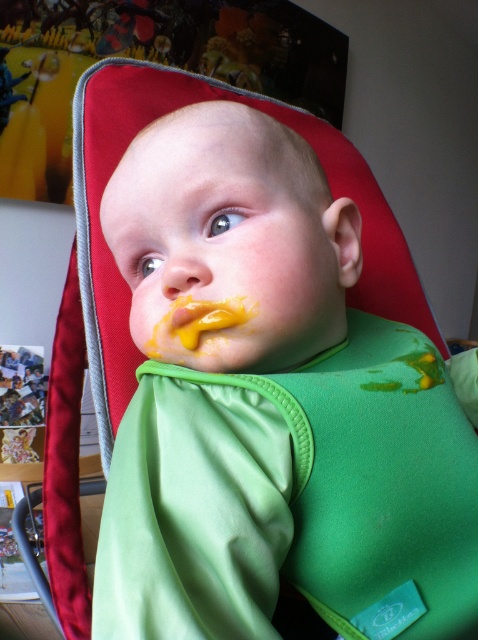
You are a caregiver who needs to clean the baby after feeding. The baby is wearing the green soft bib at center and has the yellow smooth paste at center on their face. Which item would you need to remove first to avoid cross contamination?

You should remove the yellow smooth paste at center from the baby first because the green soft bib at center is larger in size and might trap the paste if not cleaned first.

The baby is sitting in a high chair with a green soft bib at center and a yellow matte nose at center. Which object is taller?

The green soft bib at center is taller than the yellow matte nose at center.

You are a pediatrician examining a baby in a high chair. You notice the yellow smooth paste at center and the yellow matte nose at center. How far apart are these two areas on the baby?

The yellow smooth paste at center and the yellow matte nose at center are 1.80 centimeters apart from each other.